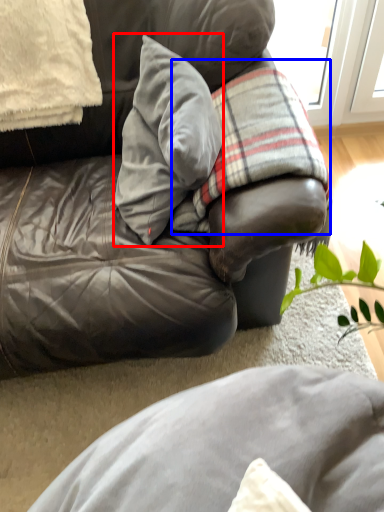
Question: Which of the following is the farthest to the observer, pillow (highlighted by a red box) or plaid (highlighted by a blue box)?

Choices:
 (A) pillow
 (B) plaid

Answer: (B)